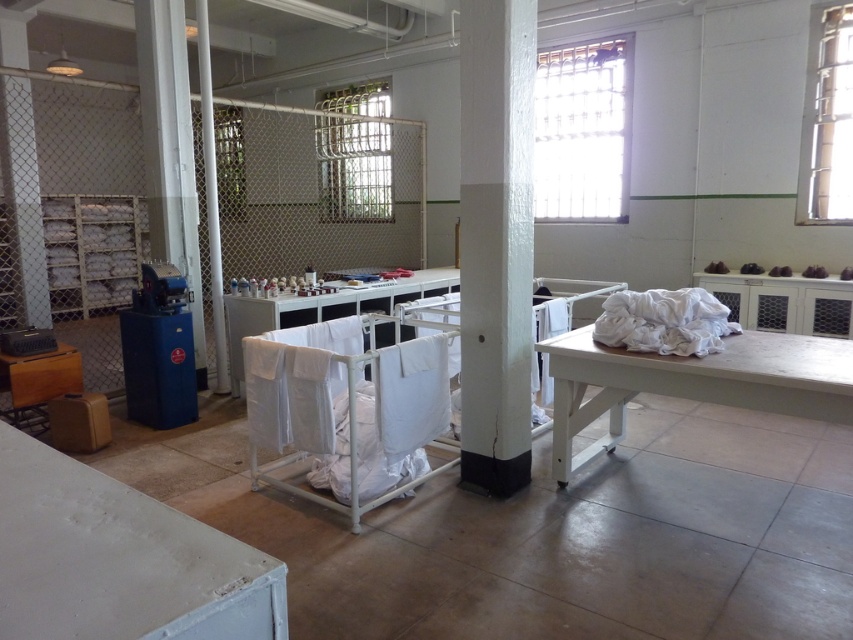
Who is positioned more to the left, white painted concrete pillar at center or wooden table at left?

From the viewer's perspective, wooden table at left appears more on the left side.

Is point (476, 237) more distant than point (6, 417)?

No, (476, 237) is in front of (6, 417).

This screenshot has height=640, width=853. I want to click on white painted concrete pillar at center, so click(495, 241).

Identify the location of white painted concrete pillar at center. This screenshot has height=640, width=853. pos(495,241).

Describe the element at coordinates (692, 384) in the screenshot. This screenshot has height=640, width=853. I see `white matte table at right` at that location.

Which is in front, point (839, 392) or point (709, 308)?

Point (839, 392) is in front.

Find the location of `white matte table at right`. white matte table at right is located at coordinates (692, 384).

Is point (506, 252) closer to camera compared to point (198, 353)?

Yes, point (506, 252) is closer to viewer.

Between point (527, 193) and point (172, 253), which one is positioned behind?

The point (172, 253) is more distant.

Identify the location of white painted concrete pillar at center. This screenshot has width=853, height=640. (495, 241).